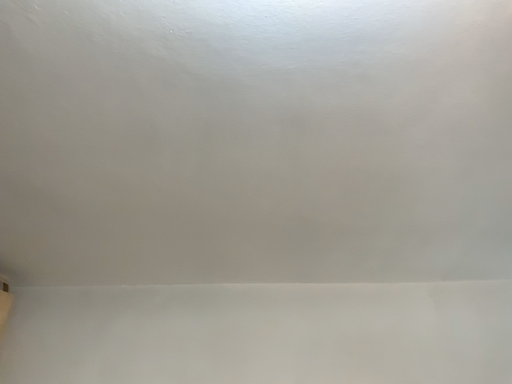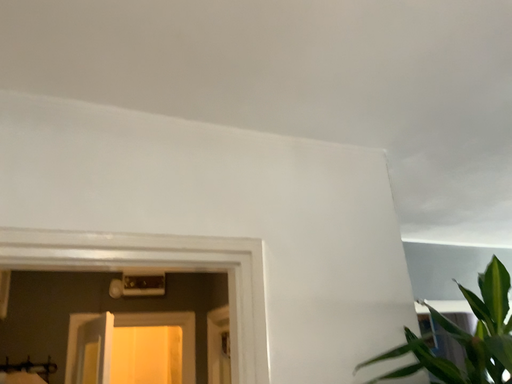
Question: Which way did the camera rotate in the video?

Choices:
 (A) rotated right
 (B) rotated left

Answer: (A)